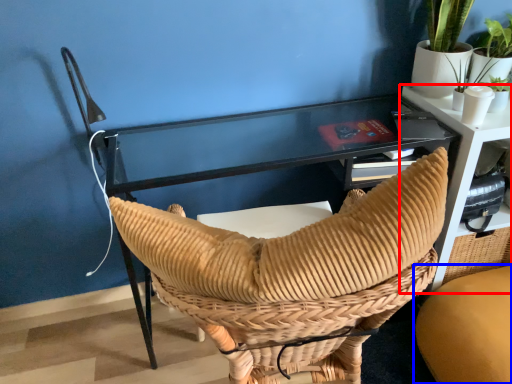
Question: Which object appears farthest to the camera in this image, table (highlighted by a red box) or chair (highlighted by a blue box)?

Choices:
 (A) table
 (B) chair

Answer: (A)